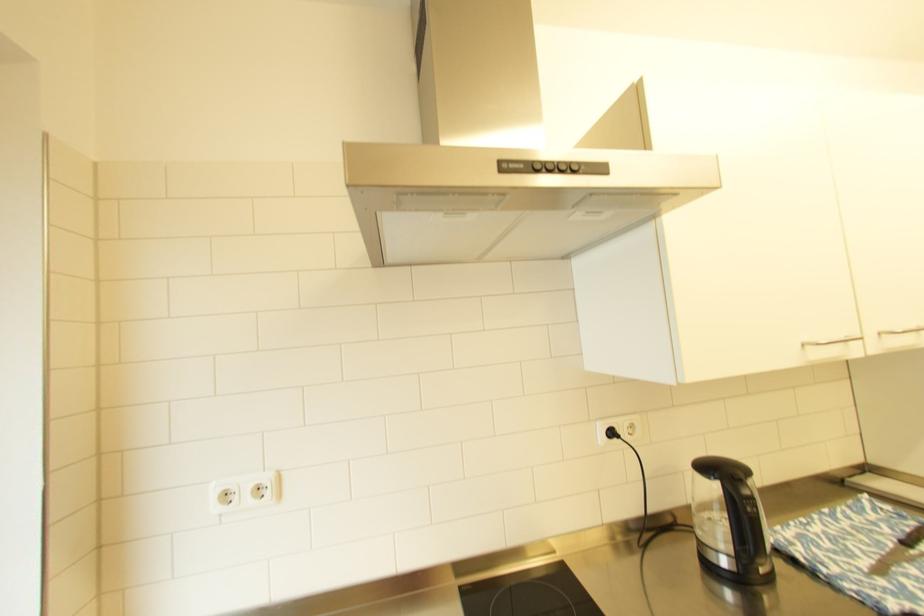
Where would you plugg the black power plug? Please return your answer as a coordinate pair (x, y).

(612, 432)